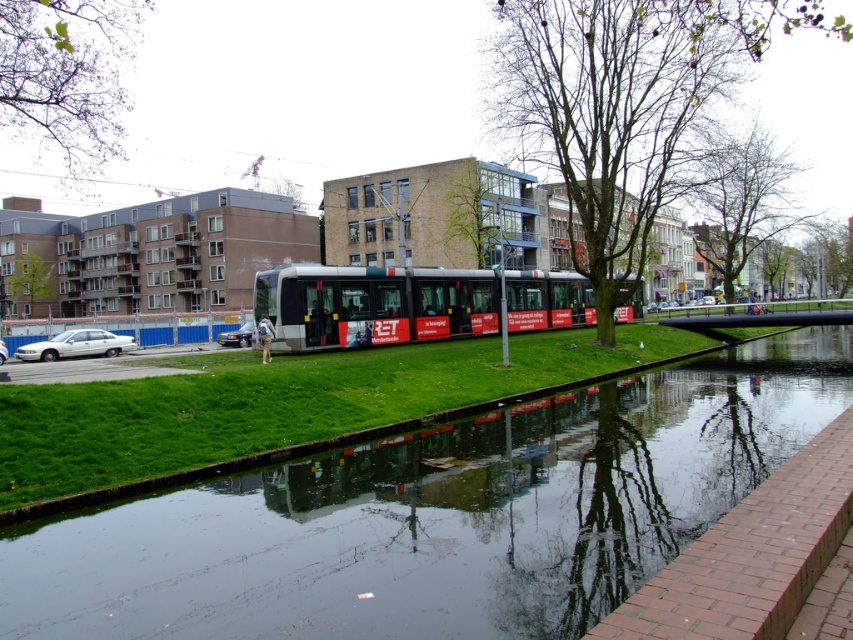
You are a delivery person needing to cross from the green grass at center to the silver metallic bus at center. Can you walk directly between them without stepping into the canal?

The distance between the green grass at center and the silver metallic bus at center is 18.16 feet, so yes, you can walk directly between them without stepping into the canal.

You are a city planner assessing the space between the green grass at center and the silver metallic bus at center. Is there enough room for a 3m wide emergency vehicle to pass through?

The green grass at center is narrower than the silver metallic bus at center. However, the exact width of the space between them isn t provided. Without knowing the actual distance, it s impossible to confirm if it s sufficient for a 3m wide emergency vehicle.